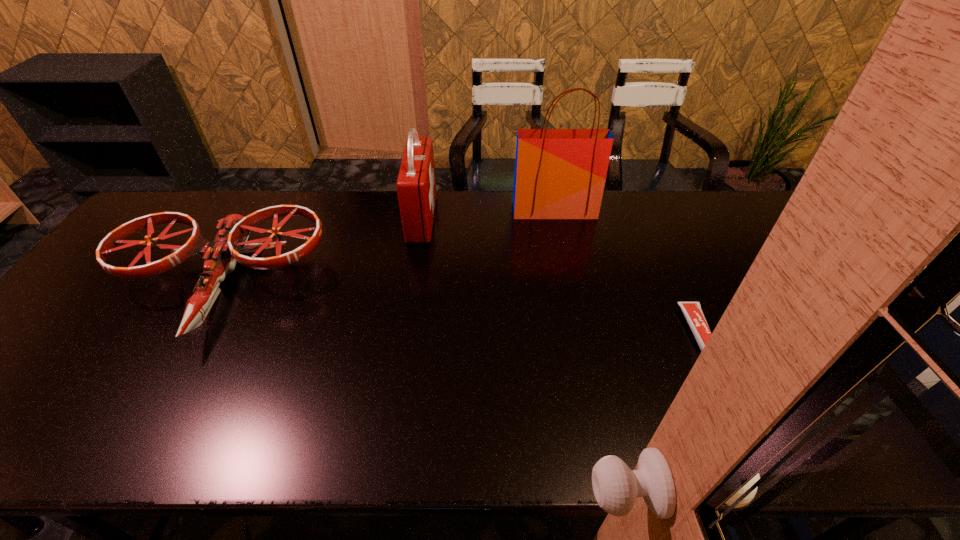
In order to click on free space located 0.170m on the back of the second shortest object in this screenshot , I will do `click(269, 202)`.

In order to click on free location located 0.080m at the nozzle of the toothpaste in this screenshot , I will do `click(725, 395)`.

Where is `shopping bag that is positioned at the far edge`? shopping bag that is positioned at the far edge is located at coordinates (559, 173).

Where is `the first-aid kit at the far edge`? This screenshot has width=960, height=540. the first-aid kit at the far edge is located at coordinates (416, 184).

At what (x,y) coordinates should I click in order to perform the action: click on drone that is at the far edge. Please return your answer as a coordinate pair (x, y). This screenshot has width=960, height=540. Looking at the image, I should click on (220, 257).

Where is `object that is at the left edge`? object that is at the left edge is located at coordinates (220, 257).

This screenshot has height=540, width=960. What are the coordinates of `object positioned at the far left corner` in the screenshot? It's located at (220, 257).

Locate an element on the screen. vacant space at the far edge is located at coordinates (343, 196).

This screenshot has width=960, height=540. In the image, there is a desktop. Identify the location of vacant space at the near edge. (723, 441).

Where is `vacant region at the left edge`? vacant region at the left edge is located at coordinates (139, 237).